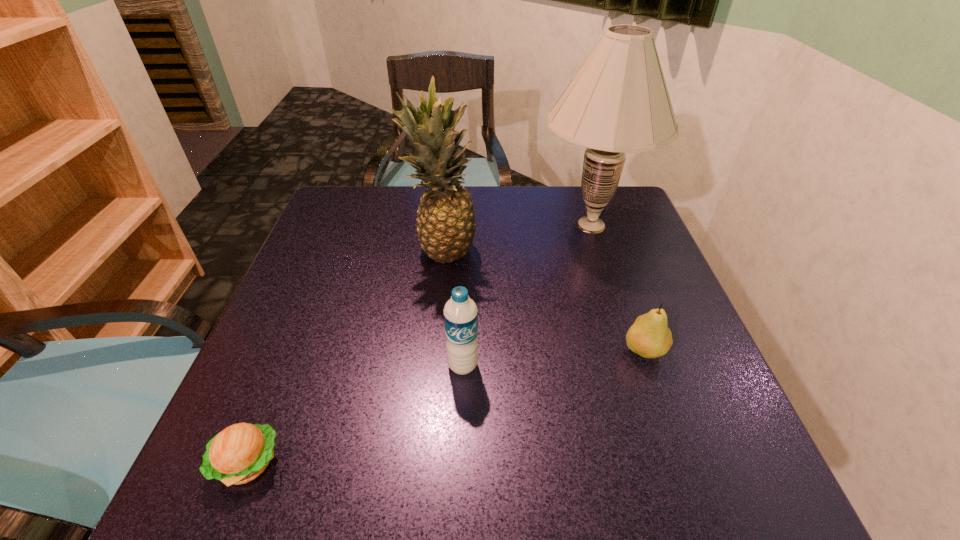
At what (x,y) coordinates should I click in order to perform the action: click on free space located on the right of the nearest object. Please return your answer as a coordinate pair (x, y). Image resolution: width=960 pixels, height=540 pixels. Looking at the image, I should click on (352, 462).

Find the location of a particular element. lampshade that is at the far edge is located at coordinates (618, 102).

In order to click on pineapple that is at the far edge in this screenshot , I will do `click(446, 225)`.

Image resolution: width=960 pixels, height=540 pixels. In order to click on object that is at the near edge in this screenshot , I will do `click(238, 454)`.

Locate an element on the screen. object at the left edge is located at coordinates (238, 454).

The width and height of the screenshot is (960, 540). I want to click on lampshade located in the right edge section of the desktop, so click(x=618, y=102).

Image resolution: width=960 pixels, height=540 pixels. Find the location of `pear located at the right edge`. pear located at the right edge is located at coordinates (649, 336).

Find the location of a particular element. object present at the near left corner is located at coordinates (238, 454).

Locate an element on the screen. This screenshot has width=960, height=540. object present at the far right corner is located at coordinates (618, 102).

Image resolution: width=960 pixels, height=540 pixels. In the image, there is a desktop. Find the location of `vacant space at the far edge`. vacant space at the far edge is located at coordinates (492, 215).